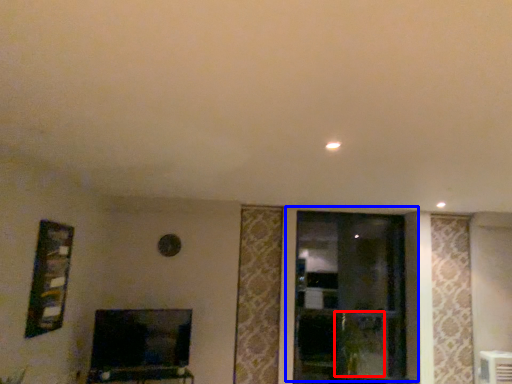
Question: Among these objects, which one is nearest to the camera, plant (highlighted by a red box) or window (highlighted by a blue box)?

Choices:
 (A) plant
 (B) window

Answer: (A)